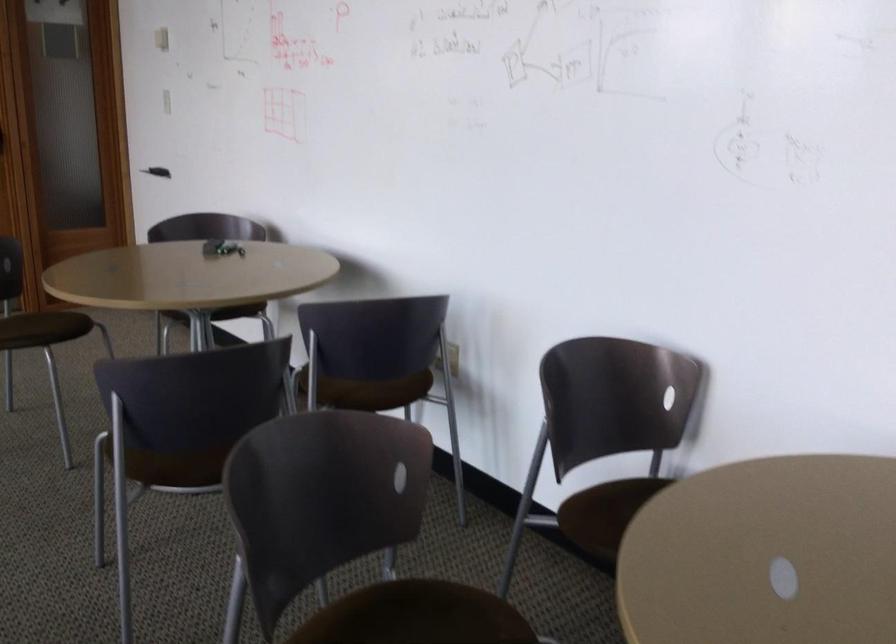
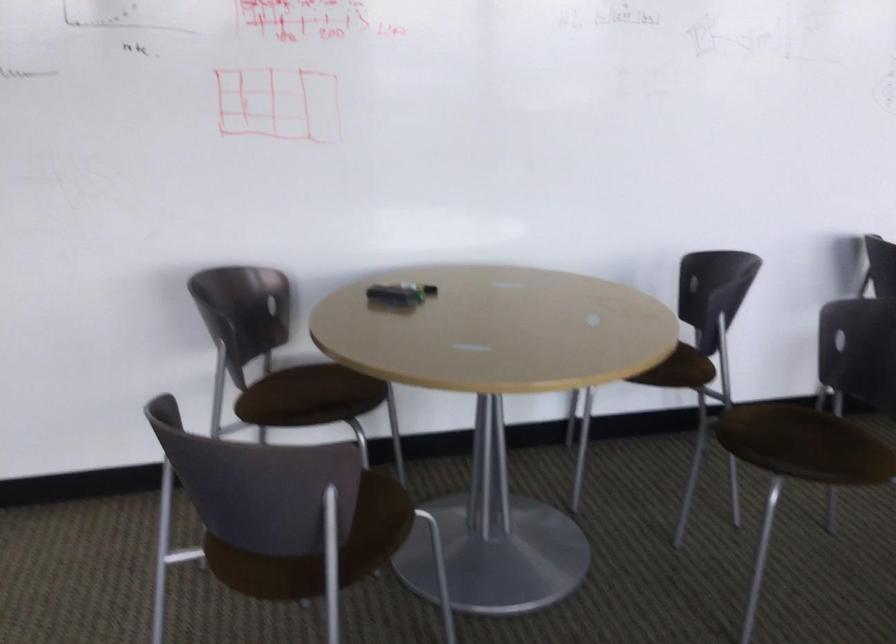
Find the pixel in the second image that matches [194,431] in the first image.

(798, 437)